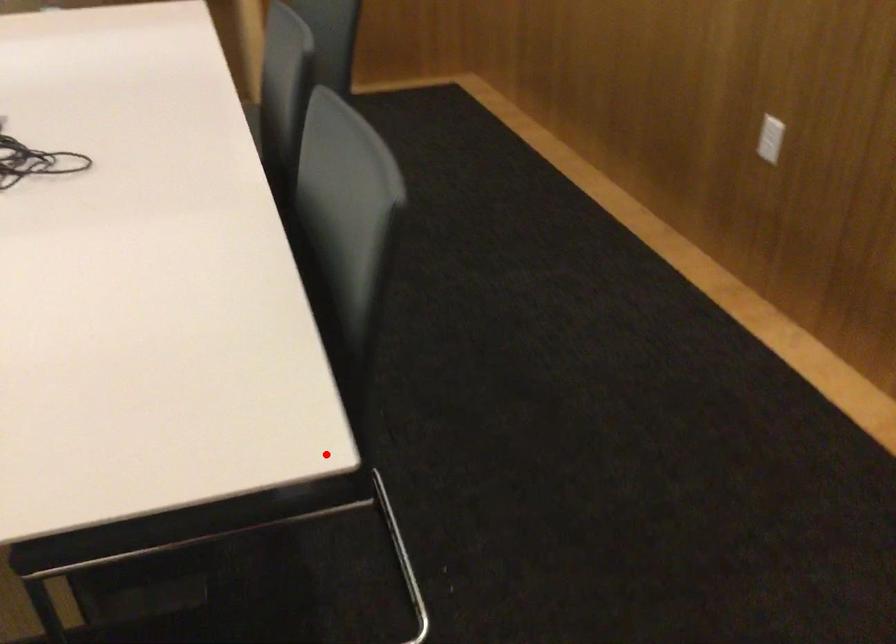
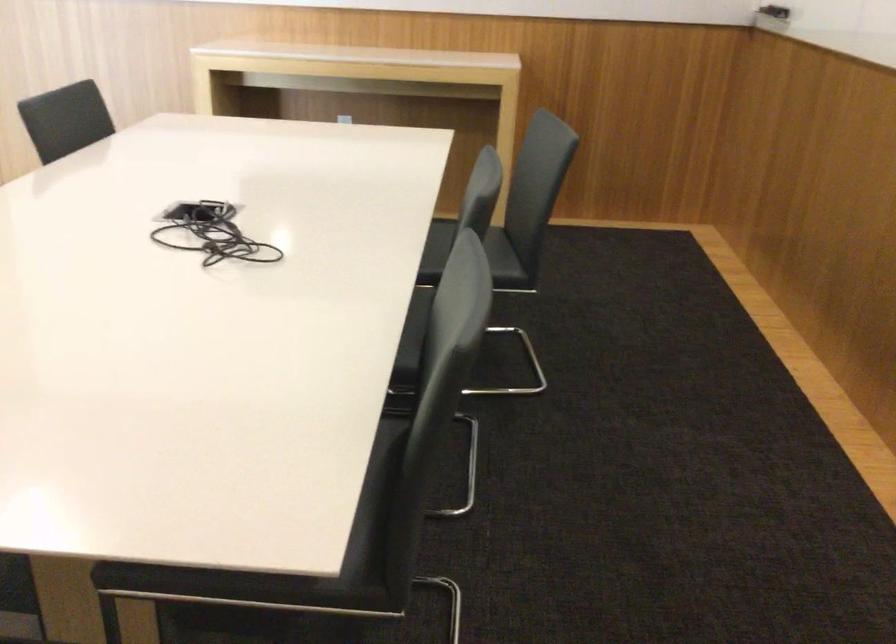
In the second image, find the point that corresponds to the highlighted location in the first image.

(311, 558)